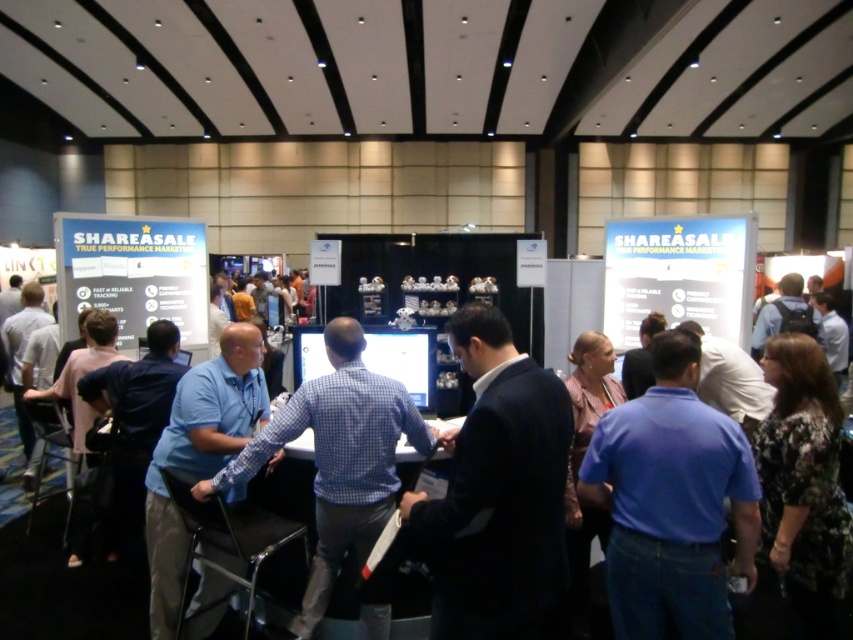
Consider the image. Is dark blue suit at center to the right of blue denim shirt at center from the viewer's perspective?

In fact, dark blue suit at center is to the left of blue denim shirt at center.

In order to click on dark blue suit at center in this screenshot , I will do `click(497, 493)`.

Is point (633, 481) positioned after point (302, 481)?

No, (633, 481) is closer to viewer.

Who is taller, blue denim shirt at center or blue shirt at center?

Standing taller between the two is blue denim shirt at center.

This screenshot has height=640, width=853. Identify the location of blue denim shirt at center. (671, 500).

Is point (448, 500) more distant than point (33, 568)?

No, it is in front of (33, 568).

Where is `dark blue suit at center`? This screenshot has height=640, width=853. dark blue suit at center is located at coordinates (497, 493).